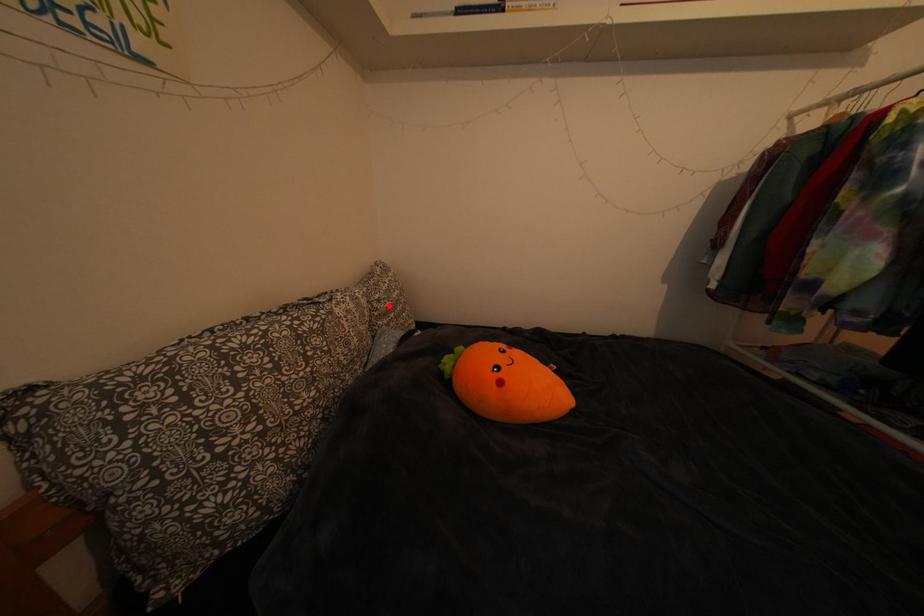
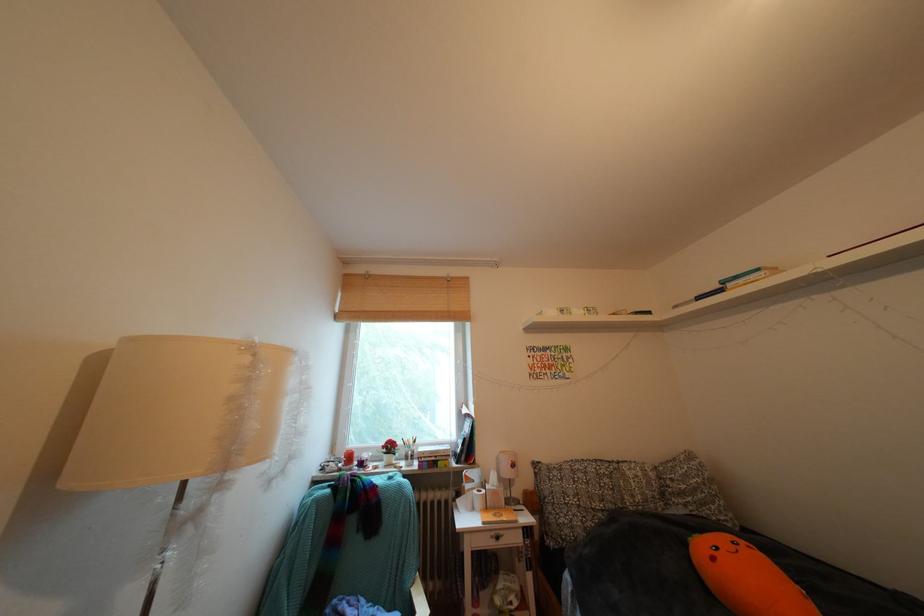
The point at the highlighted location is marked in the first image. Where is the corresponding point in the second image?

(682, 485)